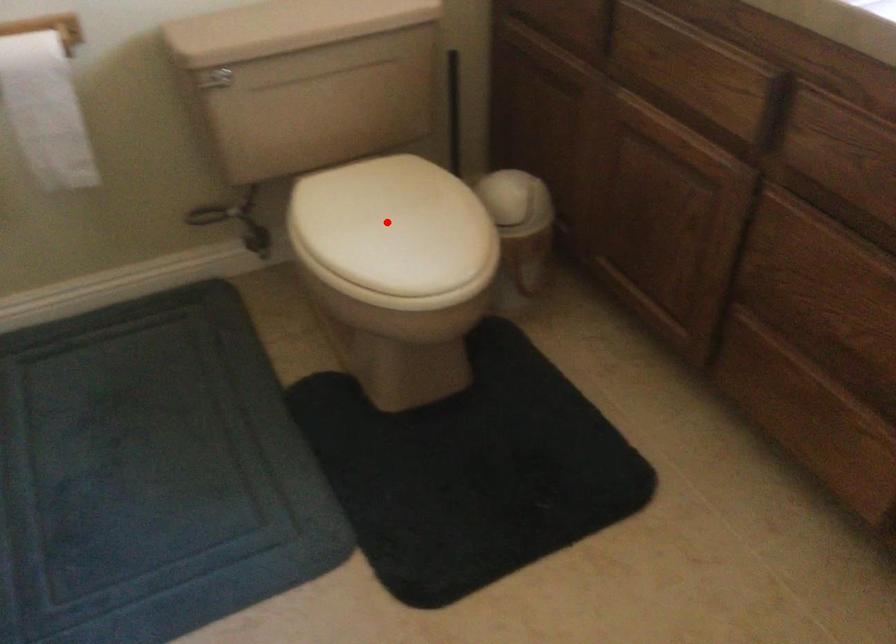
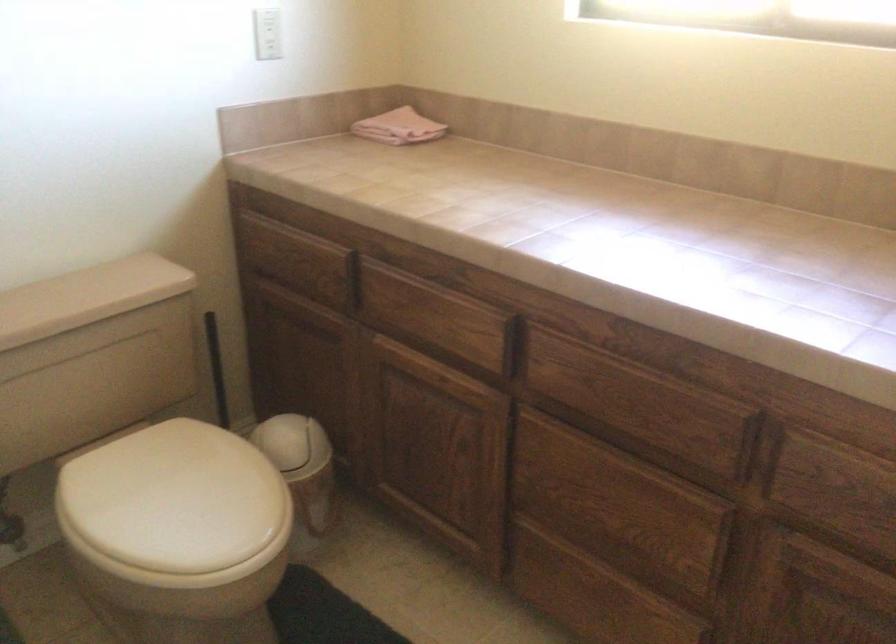
The point at the highlighted location is marked in the first image. Where is the corresponding point in the second image?

(176, 500)